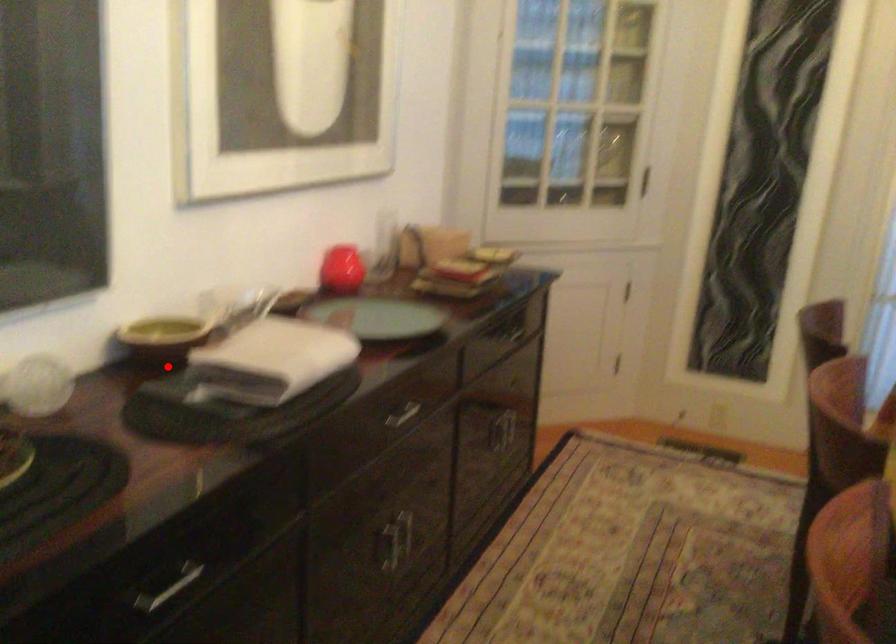
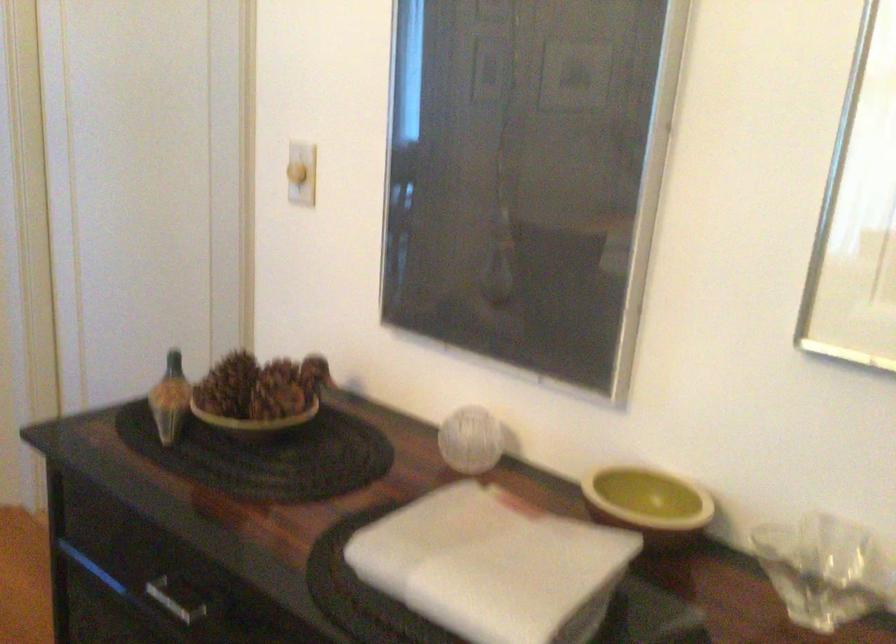
Question: I am providing you with two images of the same scene from different viewpoints. In image1, a red point is highlighted. Considering the same 3D point in image2, which of the following is correct?

Choices:
 (A) It is closer
 (B) It is farther

Answer: (A)